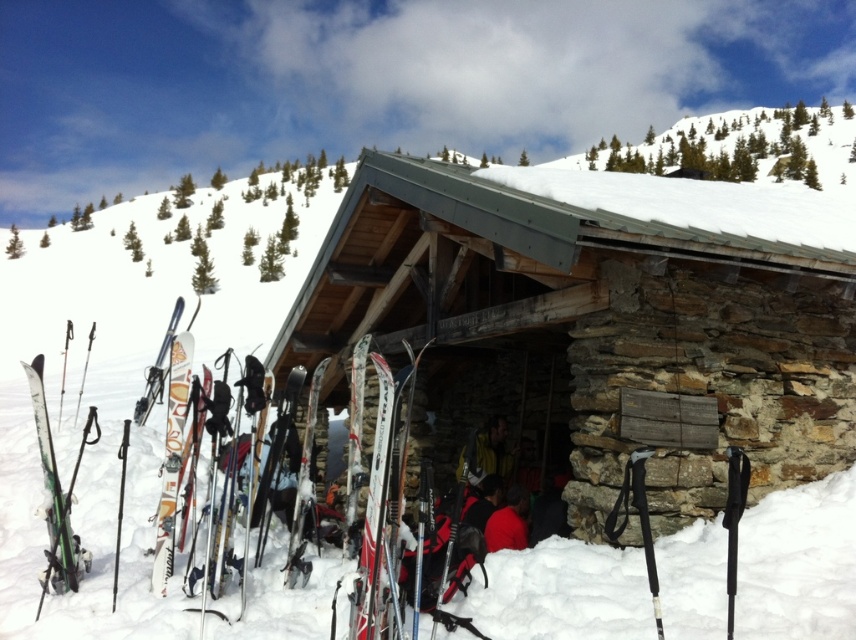
You are a skier standing at the entrance of the shelter and want to grab your skis. Which skis, the green matte skis at left or the white glossy ski at center, are easier to reach without moving your position?

The green matte skis at left are closer to the viewer than the white glossy ski at center, so they are easier to reach without moving.

You are a skier who has just arrived at the mountain shelter and needs to retrieve your equipment. Your skis are 2 meters long. You see the green matte skis at left and the shiny metallic ski at center. Can you store both pairs of skis side by side along the 2.5 meter long storage rack provided at the shelter?

The distance between the green matte skis at left and shiny metallic ski at center is 2.33 meters. Since your skis are 2 meters long, storing both pairs side by side would require a minimum space of 2 meters plus 2 meters equals 4 meters. However, the storage rack is only 2.5 meters long, so it is not possible to store both pairs of skis side by side on the rack.

You are standing at the shelter in the snowy mountain landscape. You notice two points marked in the image. Which point, point [45,445] or point [360,442], is closer to you?

Point [45,445] is closer to the viewer than point [360,442].